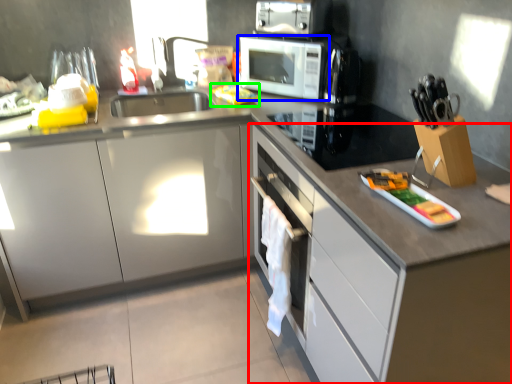
Question: Estimate the real-world distances between objects in this image. Which object is closer to cabinetry (highlighted by a red box), home appliance (highlighted by a blue box) or food (highlighted by a green box)?

Choices:
 (A) home appliance
 (B) food

Answer: (A)